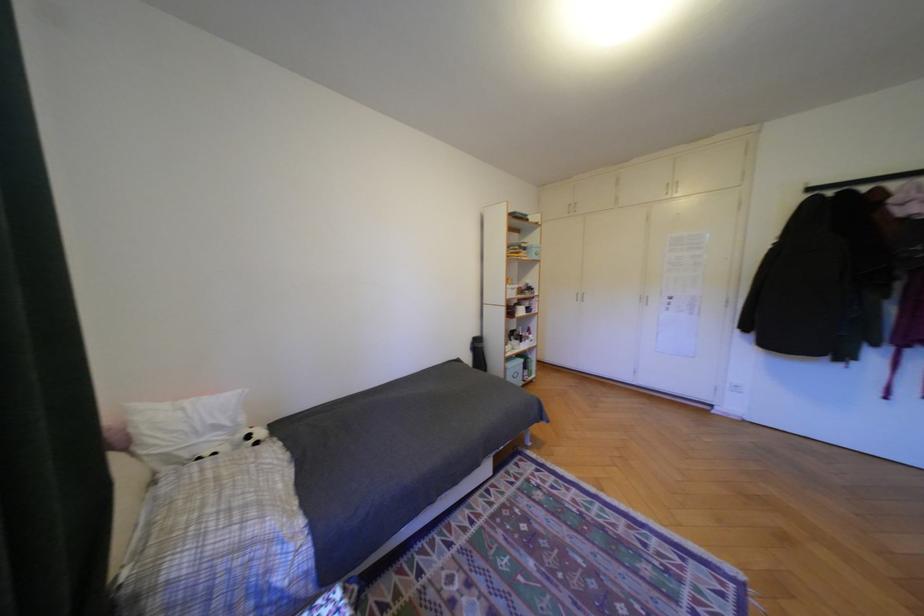
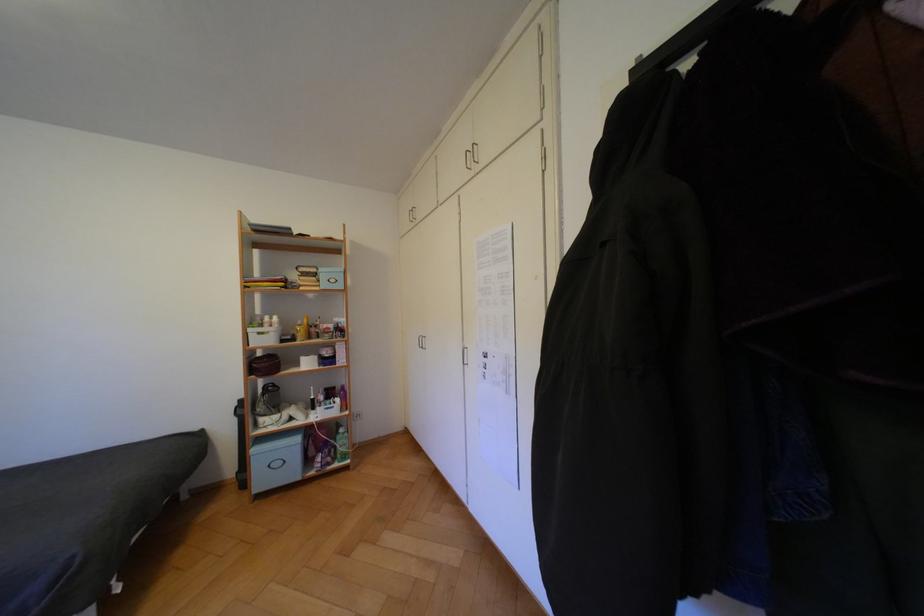
What movement of the cameraman would produce the second image?

The cameraman walked toward right, forward.